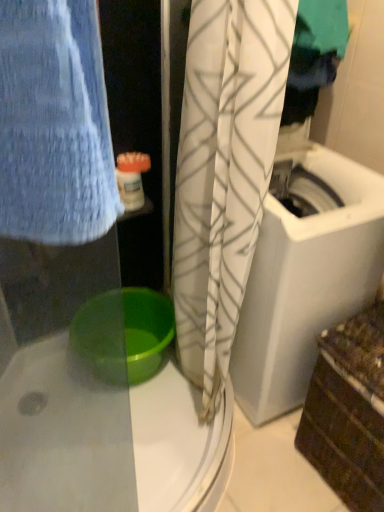
Question: Should I look upward or downward to see green plastic basin at lower center?

Choices:
 (A) up
 (B) down

Answer: (B)

Question: Is green plastic basin at lower center oriented away from white textured curtain at center?

Choices:
 (A) no
 (B) yes

Answer: (A)

Question: Can you confirm if green plastic basin at lower center is smaller than white textured curtain at center?

Choices:
 (A) no
 (B) yes

Answer: (B)

Question: Can you confirm if green plastic basin at lower center is thinner than white textured curtain at center?

Choices:
 (A) no
 (B) yes

Answer: (A)

Question: From the image's perspective, is green plastic basin at lower center beneath white textured curtain at center?

Choices:
 (A) yes
 (B) no

Answer: (A)

Question: Can you confirm if green plastic basin at lower center is wider than white textured curtain at center?

Choices:
 (A) yes
 (B) no

Answer: (A)

Question: Can you confirm if green plastic basin at lower center is positioned to the right of white textured curtain at center?

Choices:
 (A) no
 (B) yes

Answer: (A)

Question: Does green plastic basin at lower center have a greater height compared to white plastic container at upper center?

Choices:
 (A) yes
 (B) no

Answer: (A)

Question: Does green plastic basin at lower center touch white plastic container at upper center?

Choices:
 (A) yes
 (B) no

Answer: (B)

Question: Considering the relative sizes of green plastic basin at lower center and white plastic container at upper center in the image provided, is green plastic basin at lower center thinner than white plastic container at upper center?

Choices:
 (A) no
 (B) yes

Answer: (A)

Question: Is green plastic basin at lower center at the right side of white plastic container at upper center?

Choices:
 (A) yes
 (B) no

Answer: (B)

Question: Is green plastic basin at lower center at the left side of white plastic container at upper center?

Choices:
 (A) no
 (B) yes

Answer: (B)

Question: Does green plastic basin at lower center have a lesser height compared to white plastic container at upper center?

Choices:
 (A) yes
 (B) no

Answer: (B)

Question: From a real-world perspective, is white textured curtain at center on green plastic basin at lower center?

Choices:
 (A) yes
 (B) no

Answer: (A)